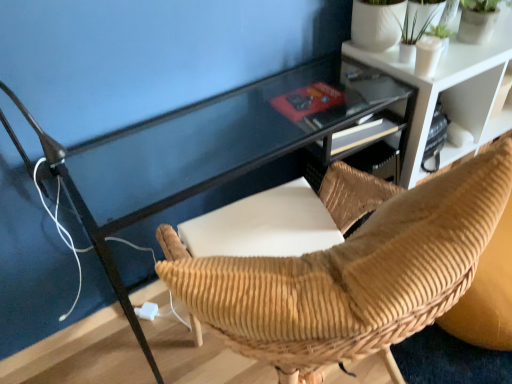
Question: Does white plastic plug at lower center come behind brown corduroy chair at center?

Choices:
 (A) no
 (B) yes

Answer: (B)

Question: Can you confirm if white plastic plug at lower center is thinner than brown corduroy chair at center?

Choices:
 (A) no
 (B) yes

Answer: (B)

Question: From the image's perspective, is white plastic plug at lower center over brown corduroy chair at center?

Choices:
 (A) no
 (B) yes

Answer: (A)

Question: From a real-world perspective, is white plastic plug at lower center physically above brown corduroy chair at center?

Choices:
 (A) no
 (B) yes

Answer: (A)

Question: Does white plastic plug at lower center appear on the left side of brown corduroy chair at center?

Choices:
 (A) no
 (B) yes

Answer: (B)

Question: Considering the relative sizes of white plastic plug at lower center and brown corduroy chair at center in the image provided, is white plastic plug at lower center taller than brown corduroy chair at center?

Choices:
 (A) yes
 (B) no

Answer: (B)

Question: Does green matte plant at upper right have a smaller size compared to white textured shelf at upper right?

Choices:
 (A) no
 (B) yes

Answer: (B)

Question: Is there a large distance between green matte plant at upper right and white textured shelf at upper right?

Choices:
 (A) no
 (B) yes

Answer: (A)

Question: Is green matte plant at upper right facing away from white textured shelf at upper right?

Choices:
 (A) no
 (B) yes

Answer: (A)

Question: Considering the relative sizes of green matte plant at upper right and white textured shelf at upper right in the image provided, is green matte plant at upper right bigger than white textured shelf at upper right?

Choices:
 (A) no
 (B) yes

Answer: (A)

Question: Is green matte plant at upper right not within white textured shelf at upper right?

Choices:
 (A) no
 (B) yes

Answer: (B)

Question: Is green matte plant at upper right wider than white textured shelf at upper right?

Choices:
 (A) yes
 (B) no

Answer: (B)

Question: Can you confirm if brown corduroy chair at center is wider than white plastic plug at lower center?

Choices:
 (A) yes
 (B) no

Answer: (A)